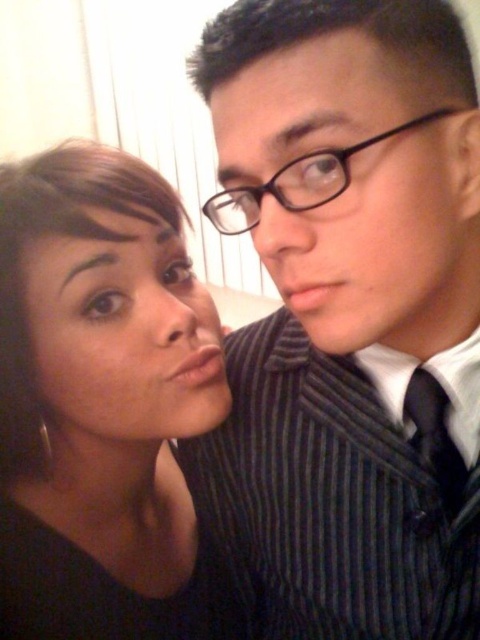
Does matte black face at lower left lie in front of black silk tie at right?

That is True.

Does matte black face at lower left have a lesser width compared to black silk tie at right?

No.

Measure the distance between point (106, 380) and camera.

A distance of 20.31 inches exists between point (106, 380) and camera.

At what (x,y) coordinates should I click in order to perform the action: click on matte black face at lower left. Please return your answer as a coordinate pair (x, y). Looking at the image, I should click on (124, 333).

What do you see at coordinates (347, 321) in the screenshot?
I see `striped fabric suit at center` at bounding box center [347, 321].

This screenshot has height=640, width=480. I want to click on striped fabric suit at center, so click(347, 321).

Where is `striped fabric suit at center`? striped fabric suit at center is located at coordinates (347, 321).

Who is positioned more to the right, matte black hair at left or black striped suit at center?

black striped suit at center

Can you confirm if matte black hair at left is wider than black striped suit at center?

Yes, matte black hair at left is wider than black striped suit at center.

I want to click on matte black hair at left, so click(101, 404).

Find the location of a particular element. The width and height of the screenshot is (480, 640). matte black hair at left is located at coordinates (101, 404).